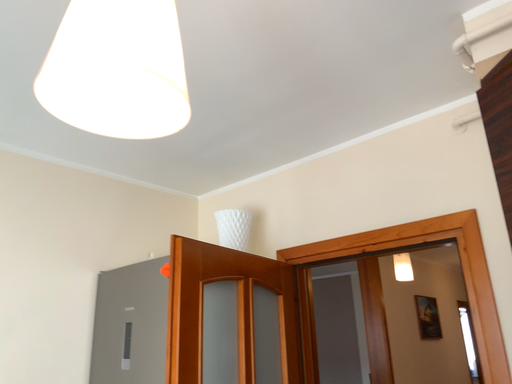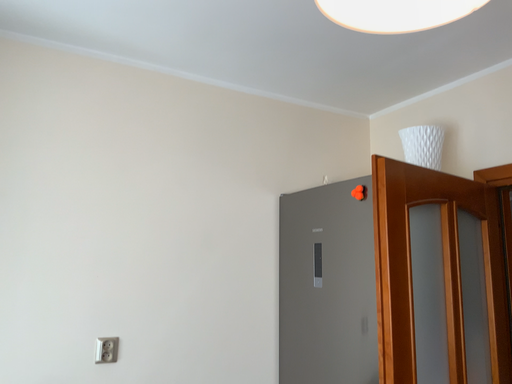
Question: Which way did the camera rotate in the video?

Choices:
 (A) rotated left
 (B) rotated right

Answer: (A)